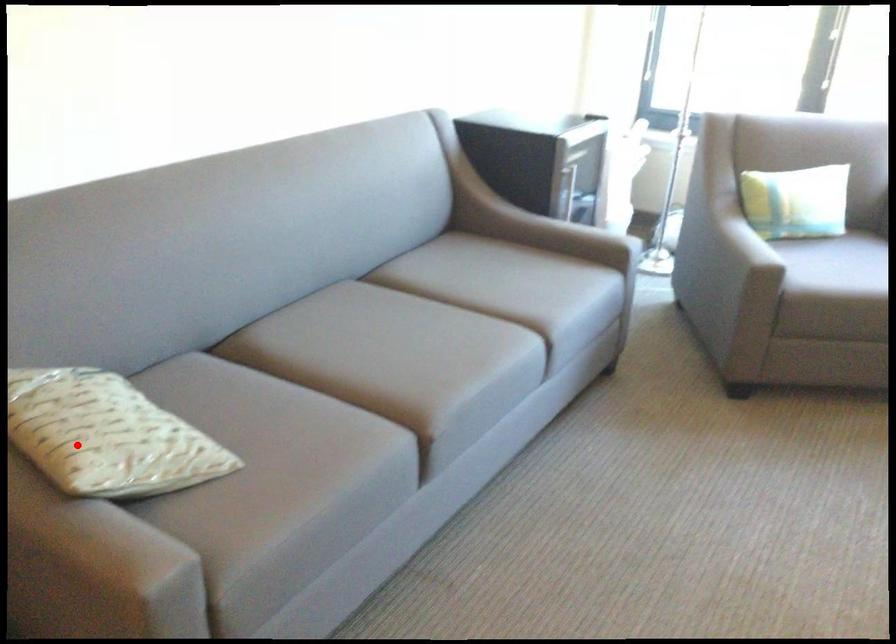
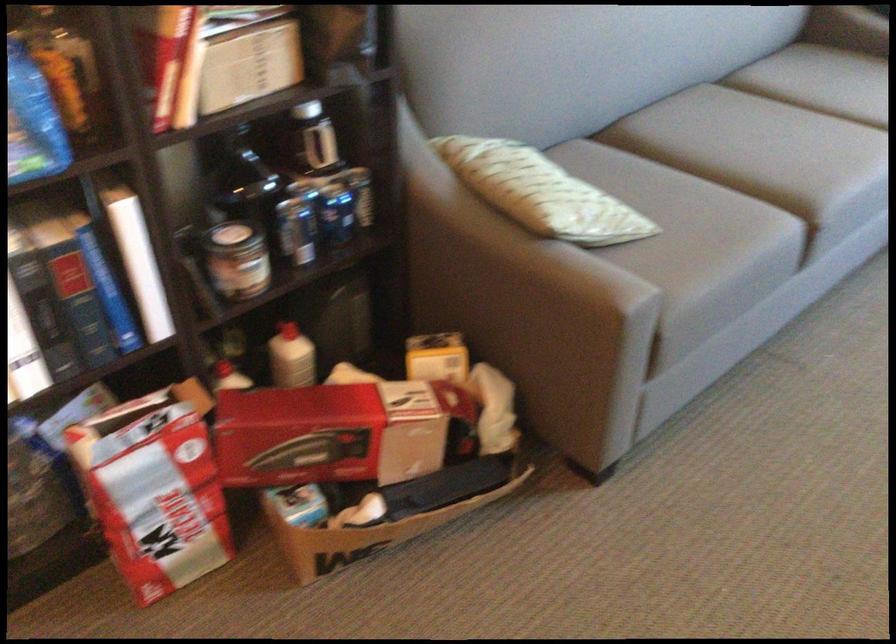
Question: I am providing you with two images of the same scene from different viewpoints. Image1 has a red point marked. In image2, the corresponding 3D location appears at what relative position? Reply with the corresponding letter.

Choices:
 (A) Closer
 (B) Farther

Answer: (B)